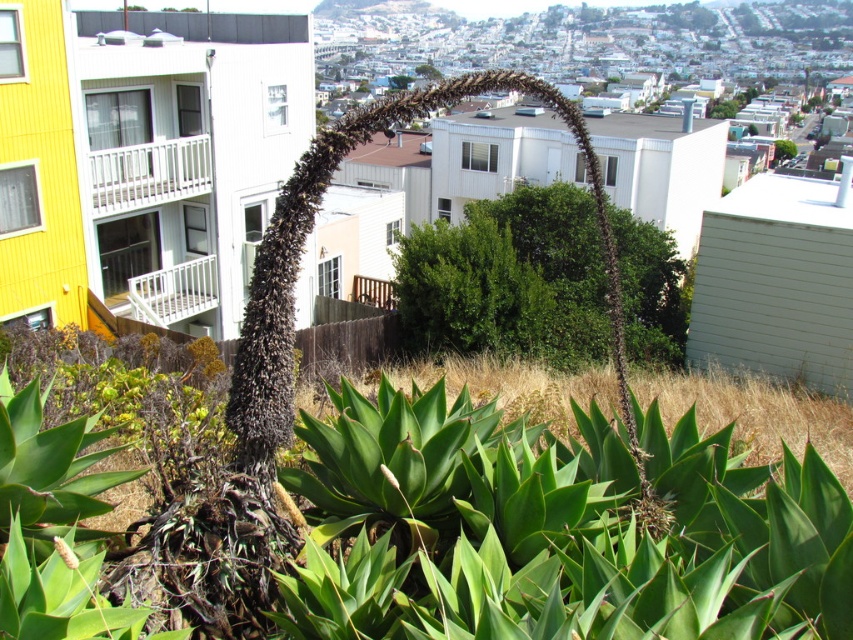
Measure the distance between point (785, 150) and camera.

Point (785, 150) is 113.75 meters from camera.

Between green leafy tree at upper right and green leafy tree at upper center, which one is positioned lower?

green leafy tree at upper right is lower down.

Is point (782, 140) in front of point (422, 65)?

That is True.

Find the location of a particular element. The image size is (853, 640). green leafy tree at upper right is located at coordinates (782, 148).

How distant is green leafy bush at center from green leafy tree at upper right?

green leafy bush at center is 106.85 meters away from green leafy tree at upper right.

Between point (532, 296) and point (779, 140), which one is positioned in front?

Point (532, 296) is in front.

Where is `green leafy bush at center`? Image resolution: width=853 pixels, height=640 pixels. green leafy bush at center is located at coordinates (508, 280).

Does green leafy bush at center have a lesser width compared to green leafy tree at upper center?

Yes, green leafy bush at center is thinner than green leafy tree at upper center.

Who is lower down, green leafy bush at center or green leafy tree at upper center?

green leafy bush at center

This screenshot has width=853, height=640. In order to click on green leafy bush at center in this screenshot , I will do `click(508, 280)`.

At what (x,y) coordinates should I click in order to perform the action: click on green leafy bush at center. Please return your answer as a coordinate pair (x, y). The width and height of the screenshot is (853, 640). Looking at the image, I should click on (508, 280).